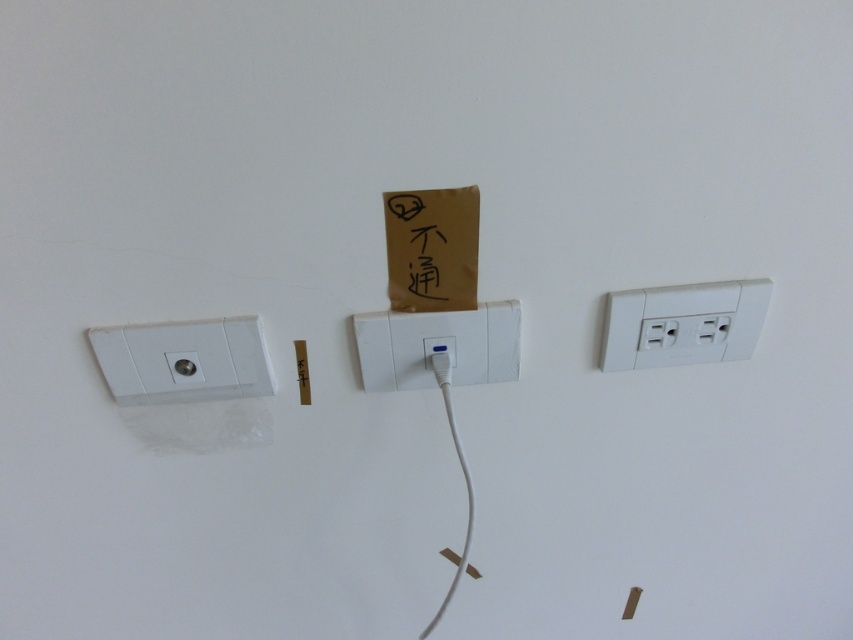
Is white plastic electric outlet at right to the left of white plastic usb port at center from the viewer's perspective?

In fact, white plastic electric outlet at right is to the right of white plastic usb port at center.

Who is higher up, white plastic electric outlet at right or white plastic usb port at center?

white plastic electric outlet at right

Does point (622, 292) come behind point (375, 348)?

Yes, point (622, 292) is behind point (375, 348).

You are a GUI agent. You are given a task and a screenshot of the screen. Output one action in this format:
    pyautogui.click(x=<x>, y=<y>)
    Task: Click on the white plastic electric outlet at right
    This screenshot has height=640, width=853.
    Given the screenshot: What is the action you would take?
    pyautogui.click(x=683, y=323)

Which of these two, white plastic socket at left or white plastic electric outlet at right, stands shorter?

With less height is white plastic socket at left.

Does white plastic socket at left appear on the left side of white plastic electric outlet at right?

Yes, white plastic socket at left is to the left of white plastic electric outlet at right.

Is point (244, 346) farther from camera compared to point (735, 310)?

No.

Where is `white plastic socket at left`? white plastic socket at left is located at coordinates (183, 360).

Is white plastic socket at left to the right of white plastic usb port at center from the viewer's perspective?

No, white plastic socket at left is not to the right of white plastic usb port at center.

Locate an element on the screen. white plastic socket at left is located at coordinates (183, 360).

You are a GUI agent. You are given a task and a screenshot of the screen. Output one action in this format:
    pyautogui.click(x=<x>, y=<y>)
    Task: Click on the white plastic socket at left
    
    Given the screenshot: What is the action you would take?
    pyautogui.click(x=183, y=360)